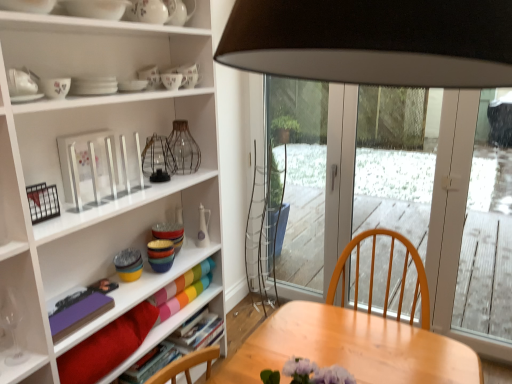
You are a GUI agent. You are given a task and a screenshot of the screen. Output one action in this format:
    pyautogui.click(x=<x>, y=<y>)
    Task: Click on the empty space that is ontop of purple matte book at lower left, acting as the first book starting from the front (from a real-world perspective)
    
    Given the screenshot: What is the action you would take?
    pyautogui.click(x=71, y=314)